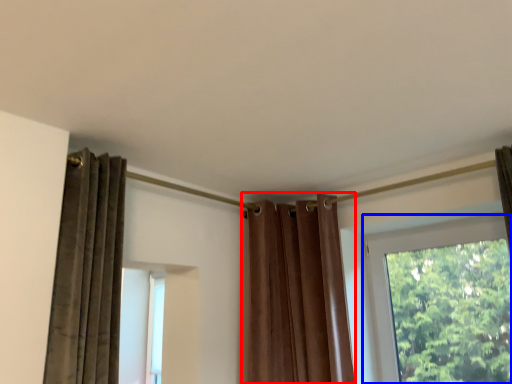
Question: Which object appears farthest to the camera in this image, curtain (highlighted by a red box) or window (highlighted by a blue box)?

Choices:
 (A) curtain
 (B) window

Answer: (A)